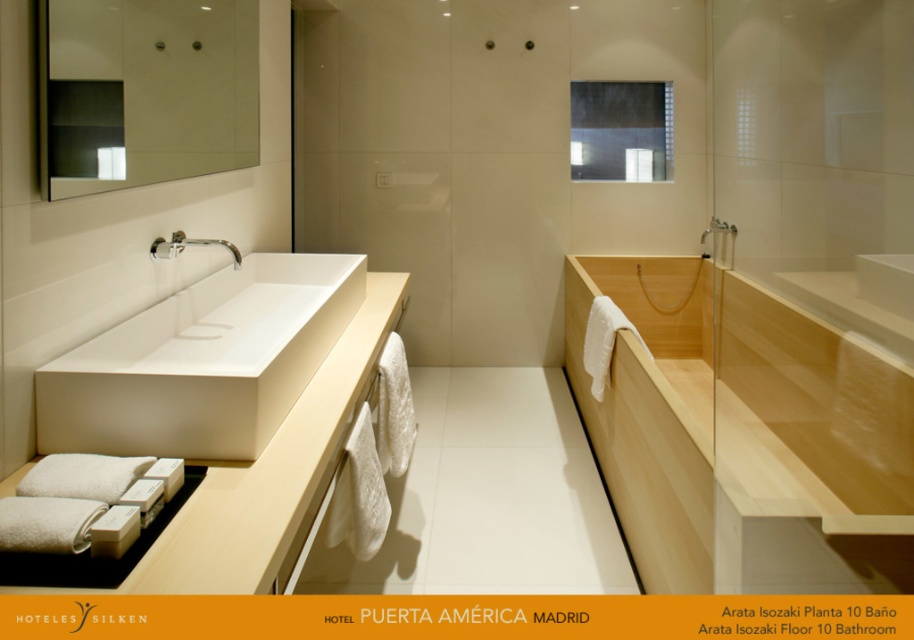
Question: Estimate the real-world distances between objects in this image. Which object is farther from the clear glass mirror at upper left?

Choices:
 (A) silver metallic faucet at upper left
 (B) white matte sink at center
 (C) natural wood bathtub at center

Answer: (C)

Question: Which point appears farthest from the camera in this image?

Choices:
 (A) (243, 346)
 (B) (190, 65)

Answer: (B)

Question: Is clear glass mirror at upper left positioned before silver metallic faucet at upper left?

Choices:
 (A) yes
 (B) no

Answer: (A)

Question: Which point is closer to the camera?

Choices:
 (A) (252, 163)
 (B) (220, 540)

Answer: (B)

Question: Can you confirm if white glossy sink at left is bigger than white matte sink at center?

Choices:
 (A) no
 (B) yes

Answer: (A)

Question: Can you confirm if white glossy sink at left is smaller than clear glass mirror at upper left?

Choices:
 (A) no
 (B) yes

Answer: (A)